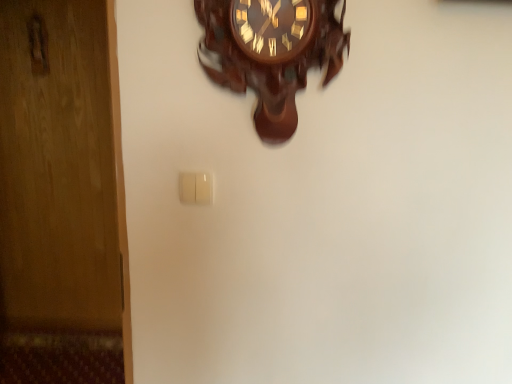
Question: Is white plastic light switch at center facing away from wooden wall clock at upper center?

Choices:
 (A) yes
 (B) no

Answer: (B)

Question: Is white plastic light switch at center in front of wooden wall clock at upper center?

Choices:
 (A) yes
 (B) no

Answer: (B)

Question: Considering the relative sizes of white plastic light switch at center and wooden wall clock at upper center in the image provided, is white plastic light switch at center wider than wooden wall clock at upper center?

Choices:
 (A) yes
 (B) no

Answer: (B)

Question: Considering the relative sizes of white plastic light switch at center and wooden wall clock at upper center in the image provided, is white plastic light switch at center shorter than wooden wall clock at upper center?

Choices:
 (A) no
 (B) yes

Answer: (B)

Question: Can you confirm if white plastic light switch at center is bigger than wooden wall clock at upper center?

Choices:
 (A) no
 (B) yes

Answer: (A)

Question: From the image's perspective, is white plastic light switch at center beneath wooden wall clock at upper center?

Choices:
 (A) yes
 (B) no

Answer: (A)

Question: Considering the relative sizes of wooden wall clock at upper center and white plastic light switch at center in the image provided, is wooden wall clock at upper center bigger than white plastic light switch at center?

Choices:
 (A) no
 (B) yes

Answer: (B)

Question: Can you confirm if wooden wall clock at upper center is smaller than white plastic light switch at center?

Choices:
 (A) yes
 (B) no

Answer: (B)

Question: From the image's perspective, is wooden wall clock at upper center on white plastic light switch at center?

Choices:
 (A) yes
 (B) no

Answer: (A)

Question: Is wooden wall clock at upper center closer to the viewer compared to white plastic light switch at center?

Choices:
 (A) no
 (B) yes

Answer: (B)

Question: From a real-world perspective, is wooden wall clock at upper center below white plastic light switch at center?

Choices:
 (A) yes
 (B) no

Answer: (B)

Question: Is wooden wall clock at upper center behind white plastic light switch at center?

Choices:
 (A) no
 (B) yes

Answer: (A)

Question: Is white plastic light switch at center in front of or behind wooden wall clock at upper center in the image?

Choices:
 (A) behind
 (B) front

Answer: (A)